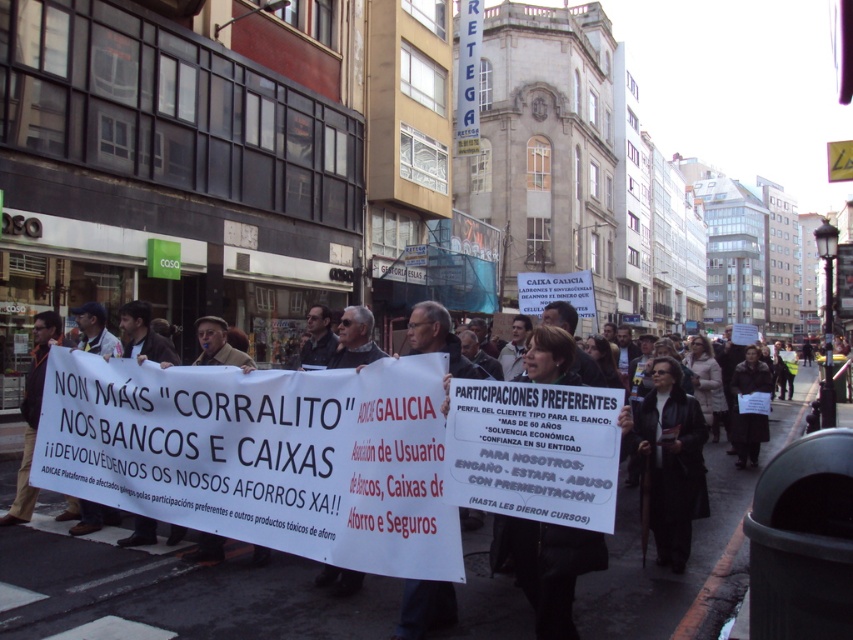
You are a photographer at the protest scene. You want to capture a clear photo of the white paper sign at center and the black leather coat at center. Which object should you focus on first to ensure it appears larger in the photo?

The white paper sign at center is larger in size than the black leather coat at center, so focusing on the white paper sign at center first will ensure it appears larger in the photo.